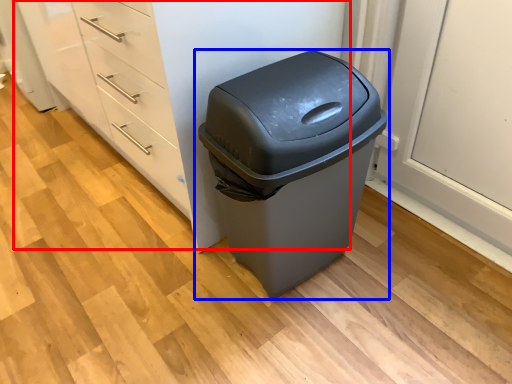
Question: Which of the following is the closest to the observer, dresser (highlighted by a red box) or waste container (highlighted by a blue box)?

Choices:
 (A) dresser
 (B) waste container

Answer: (B)